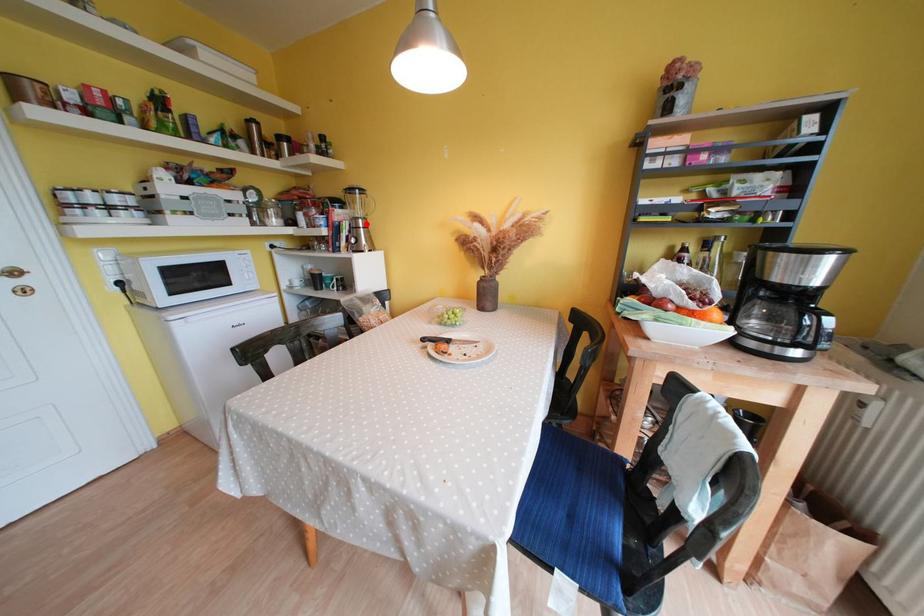
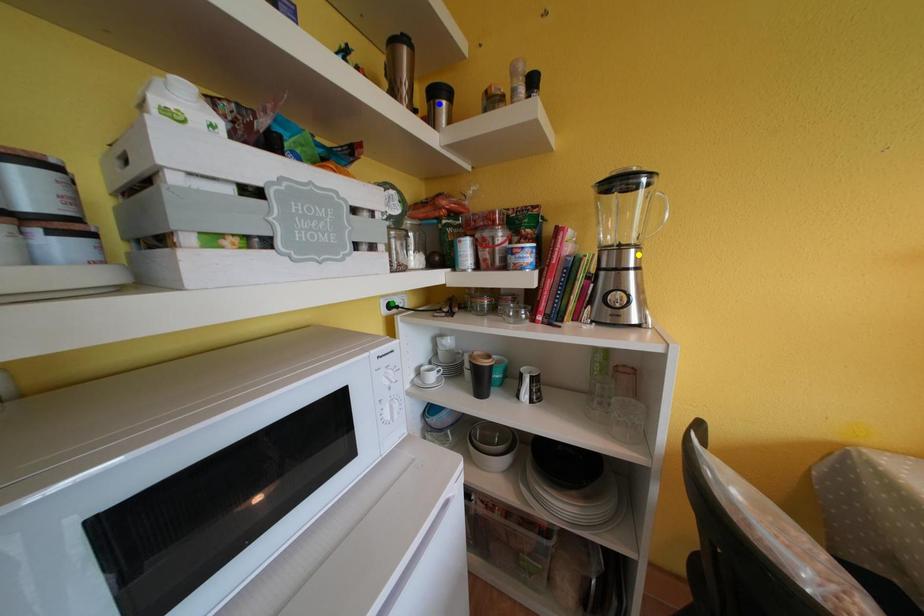
Question: I am providing you with two images of the same scene from different viewpoints. A red point is marked on the first image. You are given multiple points on the second image. In image 2, which mark is for the same physical point as the one in image 1?

Choices:
 (A) yellow point
 (B) green point
 (C) blue point

Answer: (A)